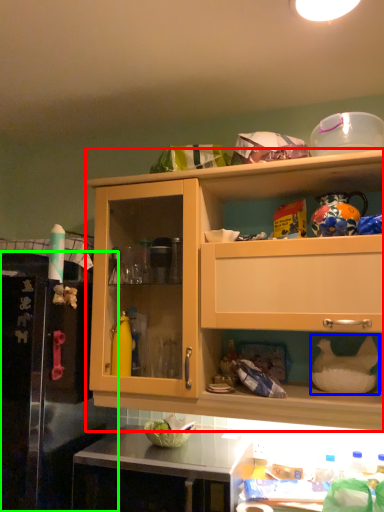
Question: Estimate the real-world distances between objects in this image. Which object is farther from cabinetry (highlighted by a red box), appliance (highlighted by a blue box) or leftover (highlighted by a green box)?

Choices:
 (A) appliance
 (B) leftover

Answer: (A)